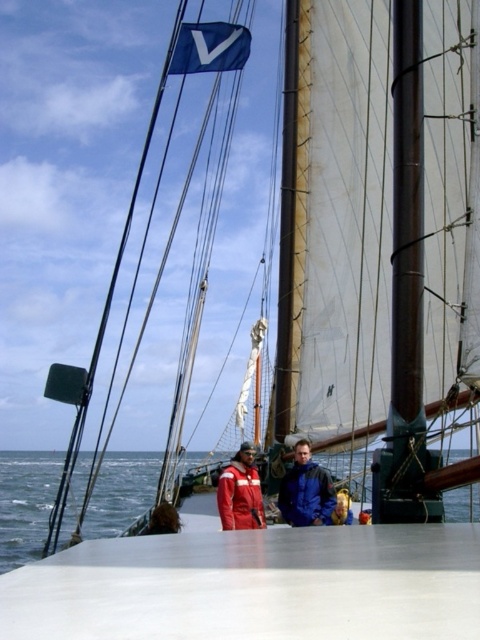
How much distance is there between red matte jacket at center and golden hair at center?

red matte jacket at center and golden hair at center are 5.84 meters apart.

Can you confirm if red matte jacket at center is smaller than golden hair at center?

No, red matte jacket at center is not smaller than golden hair at center.

Does point (216, 506) come farther from viewer compared to point (336, 520)?

Yes, it is.

What are the coordinates of `red matte jacket at center` in the screenshot? It's located at (240, 492).

Between blue matte jacket at center and golden hair at center, which one appears on the right side from the viewer's perspective?

Positioned to the right is golden hair at center.

Based on the photo, is blue matte jacket at center further to the viewer compared to golden hair at center?

No, blue matte jacket at center is in front of golden hair at center.

Who is more distant from viewer, (303, 497) or (350, 512)?

The point (350, 512) is behind.

At what (x,y) coordinates should I click in order to perform the action: click on blue matte jacket at center. Please return your answer as a coordinate pair (x, y). The width and height of the screenshot is (480, 640). Looking at the image, I should click on (305, 490).

Is point (211, 28) closer to camera compared to point (346, 499)?

No, it is behind (346, 499).

Does blue fabric flag at upper center appear on the right side of golden hair at center?

In fact, blue fabric flag at upper center is to the left of golden hair at center.

What do you see at coordinates (210, 48) in the screenshot? I see `blue fabric flag at upper center` at bounding box center [210, 48].

I want to click on blue fabric flag at upper center, so [210, 48].